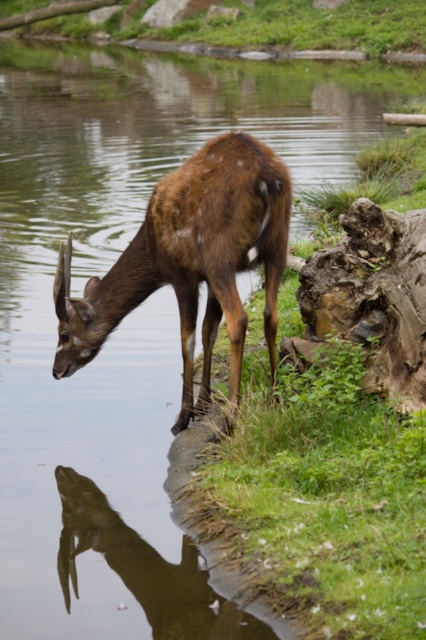
Question: Does brown matte/deer at center have a greater width compared to brown glossy antelope at lower left?

Choices:
 (A) yes
 (B) no

Answer: (A)

Question: Which point appears farthest from the camera in this image?

Choices:
 (A) (103, 323)
 (B) (215, 618)

Answer: (A)

Question: Can you confirm if brown matte/deer at center is smaller than brown glossy antelope at lower left?

Choices:
 (A) yes
 (B) no

Answer: (B)

Question: In this image, where is brown matte/deer at center located relative to brown glossy antelope at lower left?

Choices:
 (A) left
 (B) right

Answer: (B)

Question: Among these points, which one is farthest from the camera?

Choices:
 (A) (264, 632)
 (B) (187, 308)

Answer: (B)